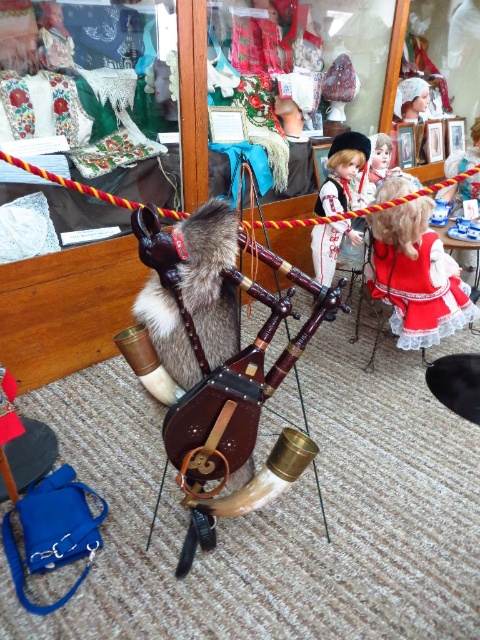
Between fur-covered animal at center and red satin dress at center, which one has less height?

fur-covered animal at center is shorter.

Does point (158, 337) lie in front of point (467, 314)?

Yes, point (158, 337) is closer to viewer.

This screenshot has width=480, height=640. Find the location of `fur-covered animal at center`. fur-covered animal at center is located at coordinates (210, 276).

Is fur-covered animal at center in front of matte black doll at center?

That is True.

Who is taller, fur-covered animal at center or matte black doll at center?

matte black doll at center

Is point (206, 310) positioned before point (339, 193)?

Yes, point (206, 310) is in front of point (339, 193).

I want to click on fur-covered animal at center, so click(210, 276).

Is red satin dress at center to the left of matte black doll at center from the viewer's perspective?

Incorrect, red satin dress at center is not on the left side of matte black doll at center.

Who is more forward, (433, 300) or (314, 269)?

Point (433, 300) is more forward.

This screenshot has width=480, height=640. Find the location of `red satin dress at center`. red satin dress at center is located at coordinates (420, 291).